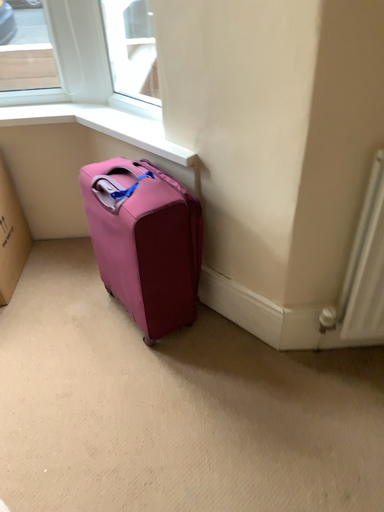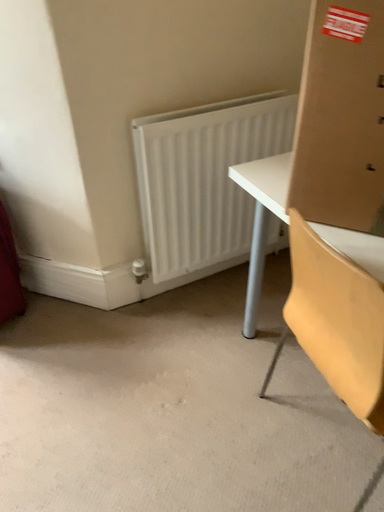
Question: Which way did the camera rotate in the video?

Choices:
 (A) rotated right
 (B) rotated left

Answer: (A)